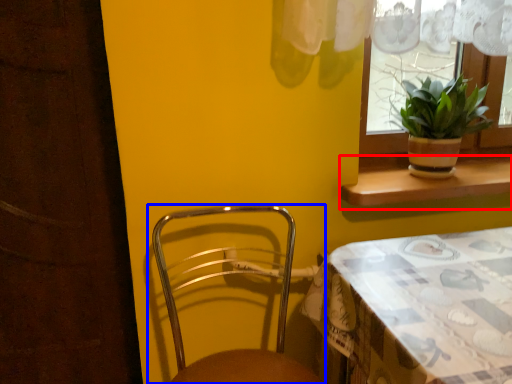
Question: Which object appears farthest to the camera in this image, window sill (highlighted by a red box) or chair (highlighted by a blue box)?

Choices:
 (A) window sill
 (B) chair

Answer: (A)